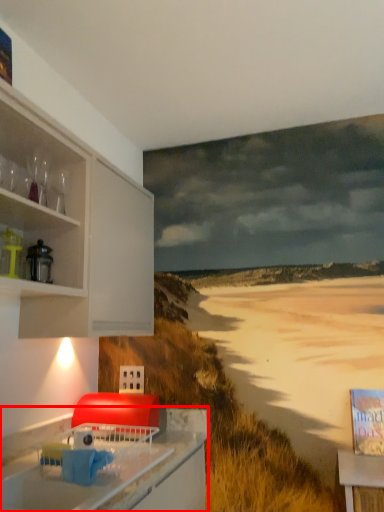
Question: Considering the relative positions of countertop (annotated by the red box) and appliance in the image provided, where is countertop (annotated by the red box) located with respect to the staircase?

Choices:
 (A) right
 (B) left

Answer: (A)